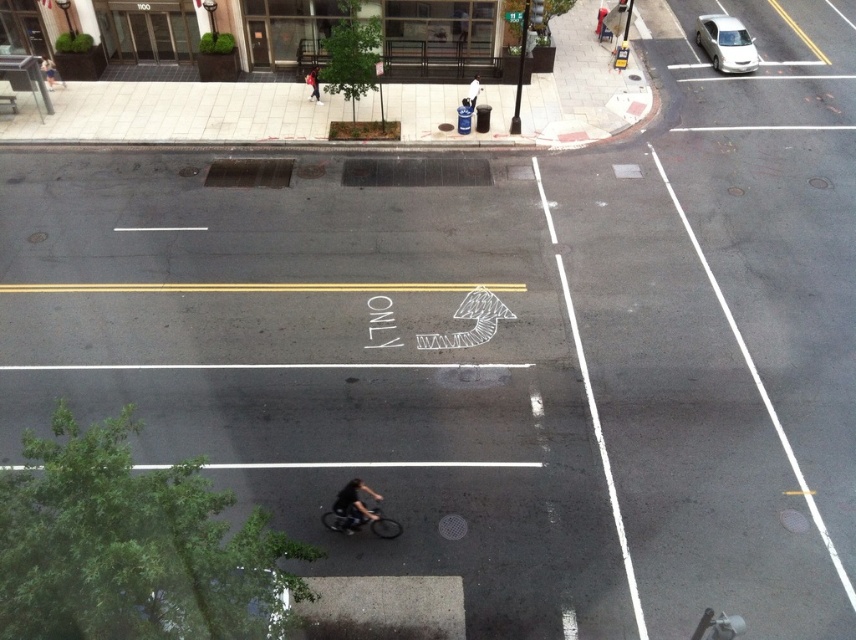
Question: Is dark gray fabric jacket at center behind dark blue jeans at center?

Choices:
 (A) no
 (B) yes

Answer: (A)

Question: Which object appears closest to the camera in this image?

Choices:
 (A) dark blue jeans at center
 (B) dark gray fabric jacket at center

Answer: (B)

Question: Among these points, which one is nearest to the camera?

Choices:
 (A) (348, 486)
 (B) (312, 96)

Answer: (A)

Question: Which point is closer to the camera?

Choices:
 (A) (752, 51)
 (B) (308, 77)

Answer: (B)

Question: Where is black matte bicycle at lower center located in relation to dark blue jeans at center in the image?

Choices:
 (A) left
 (B) right

Answer: (B)

Question: Does silver metallic car at upper right appear under black matte bicycle at lower center?

Choices:
 (A) yes
 (B) no

Answer: (B)